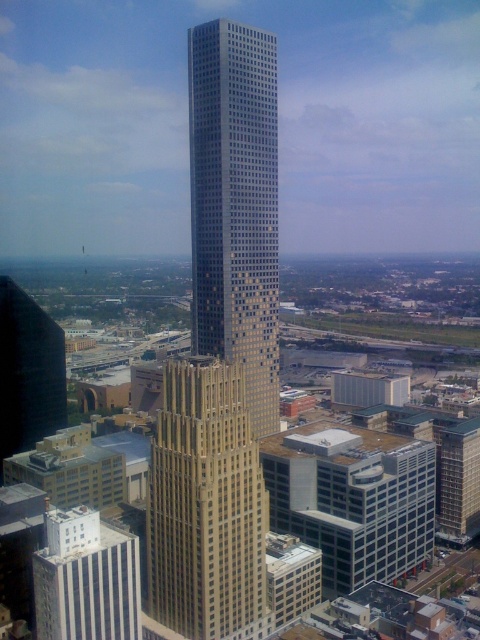
You are standing in the city square and see the beige stone skyscraper at center. There is a point marked at coordinates (205,506). Can you determine if this point is located on the beige stone skyscraper at center?

The point (205,506) is located on the beige stone skyscraper at center, so yes, the point is on the beige stone skyscraper at center.